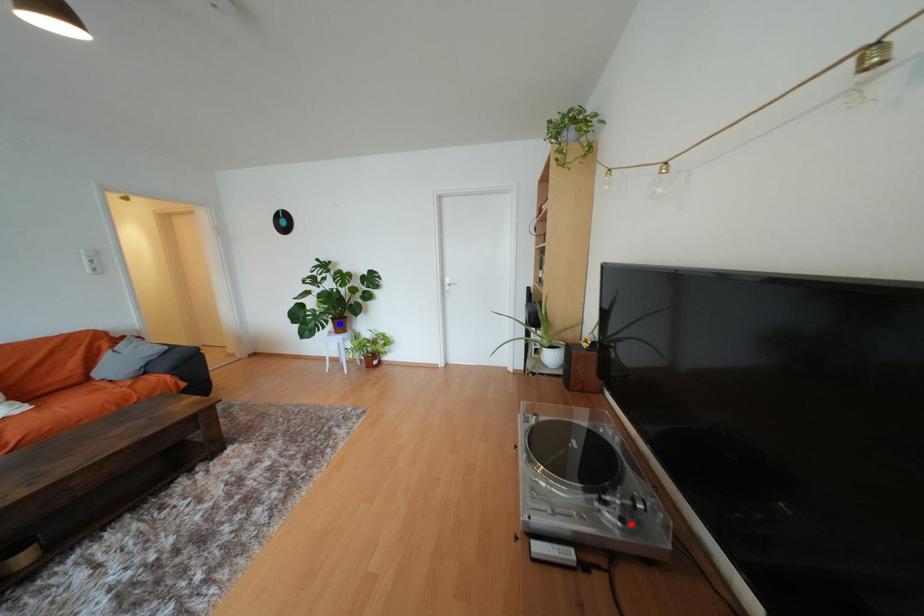
Question: Two points are marked on the image. Which point is closer to the camera?

Choices:
 (A) Blue point is closer.
 (B) Red point is closer.

Answer: (B)